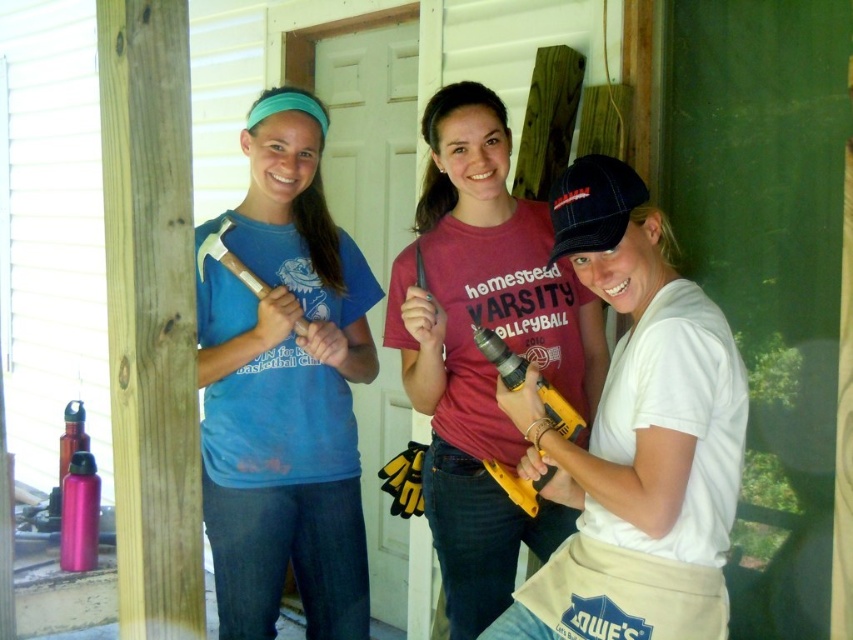
Is white matte drill at center positioned before black fabric baseball cap at center?

Yes, white matte drill at center is in front of black fabric baseball cap at center.

Can you confirm if white matte drill at center is positioned to the left of black fabric baseball cap at center?

In fact, white matte drill at center is to the right of black fabric baseball cap at center.

Is point (635, 573) closer to viewer compared to point (556, 252)?

Yes, it is in front of point (556, 252).

Identify the location of white matte drill at center. (635, 436).

Is the position of matte pink shirt at center more distant than that of metallic hammer at center?

That is False.

Who is higher up, matte pink shirt at center or metallic hammer at center?

metallic hammer at center is above.

Locate an element on the screen. Image resolution: width=853 pixels, height=640 pixels. matte pink shirt at center is located at coordinates (479, 352).

Who is more forward, (265, 612) or (496, 337)?

Positioned in front is point (496, 337).

What do you see at coordinates (283, 388) in the screenshot?
I see `matte blue t-shirt at center` at bounding box center [283, 388].

This screenshot has width=853, height=640. What do you see at coordinates (283, 388) in the screenshot? I see `matte blue t-shirt at center` at bounding box center [283, 388].

Image resolution: width=853 pixels, height=640 pixels. I want to click on matte blue t-shirt at center, so click(283, 388).